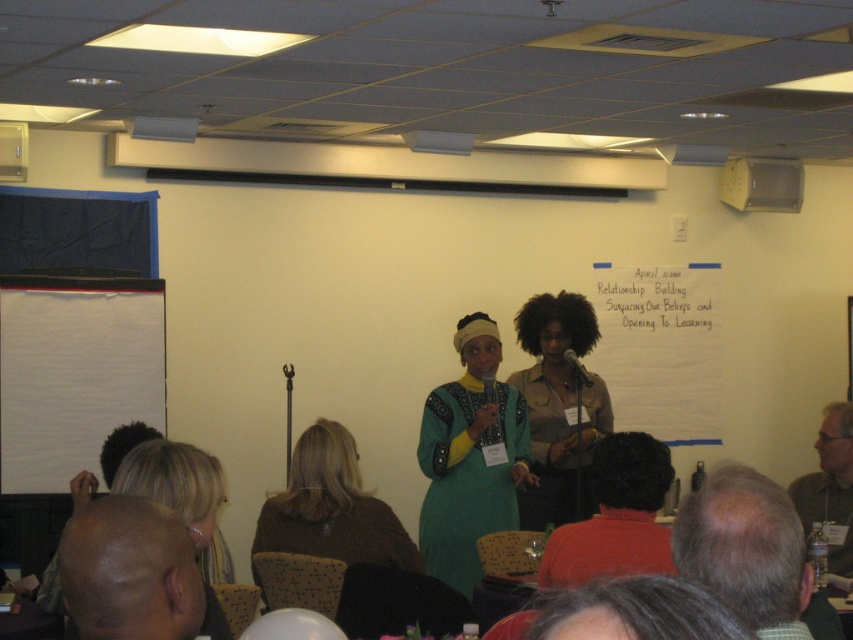
Consider the image. Between brown fuzzy sweater at lower center and yellow plastic projector at upper center, which one is positioned lower?

brown fuzzy sweater at lower center is below.

Which is behind, point (306, 506) or point (757, 198)?

Point (757, 198)

The image size is (853, 640). I want to click on brown fuzzy sweater at lower center, so click(329, 508).

Between teal fabric dress at center and white paperboard at center, which one has less height?

white paperboard at center is shorter.

Between point (457, 380) and point (625, 282), which one is positioned in front?

Point (457, 380)

Find the location of a particular element. teal fabric dress at center is located at coordinates (469, 458).

Between teal fabric dress at center and matte khaki shirt at center, which one is positioned higher?

matte khaki shirt at center

Looking at this image, does teal fabric dress at center appear over matte khaki shirt at center?

No, teal fabric dress at center is not above matte khaki shirt at center.

Image resolution: width=853 pixels, height=640 pixels. Describe the element at coordinates (469, 458) in the screenshot. I see `teal fabric dress at center` at that location.

You are a GUI agent. You are given a task and a screenshot of the screen. Output one action in this format:
    pyautogui.click(x=<x>, y=<y>)
    Task: Click on the teal fabric dress at center
    The image size is (853, 640).
    Given the screenshot: What is the action you would take?
    pyautogui.click(x=469, y=458)